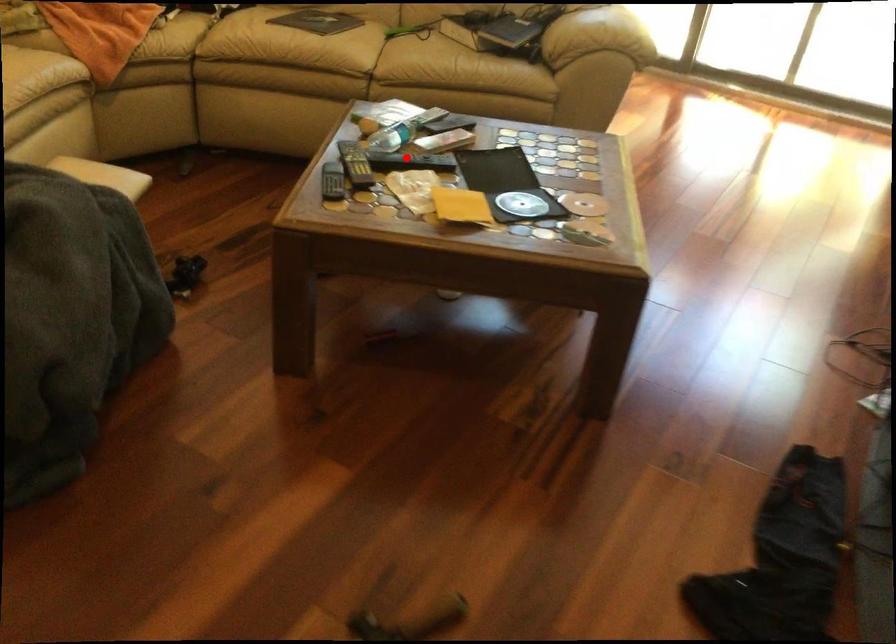
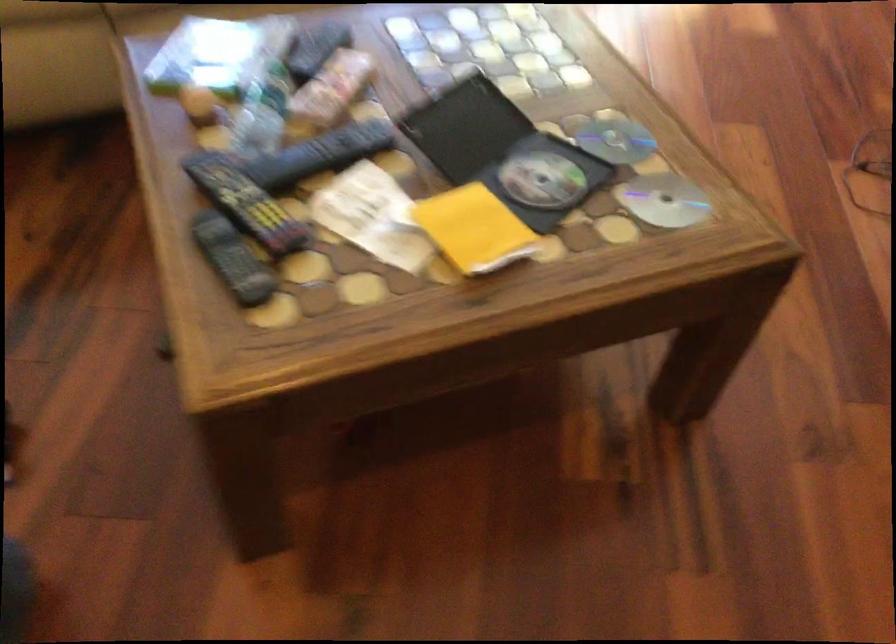
Question: I am providing you with two images of the same scene from different viewpoints. In image1, a red point is highlighted. Considering the same 3D point in image2, which of the following is correct?

Choices:
 (A) It is closer
 (B) It is farther

Answer: (A)